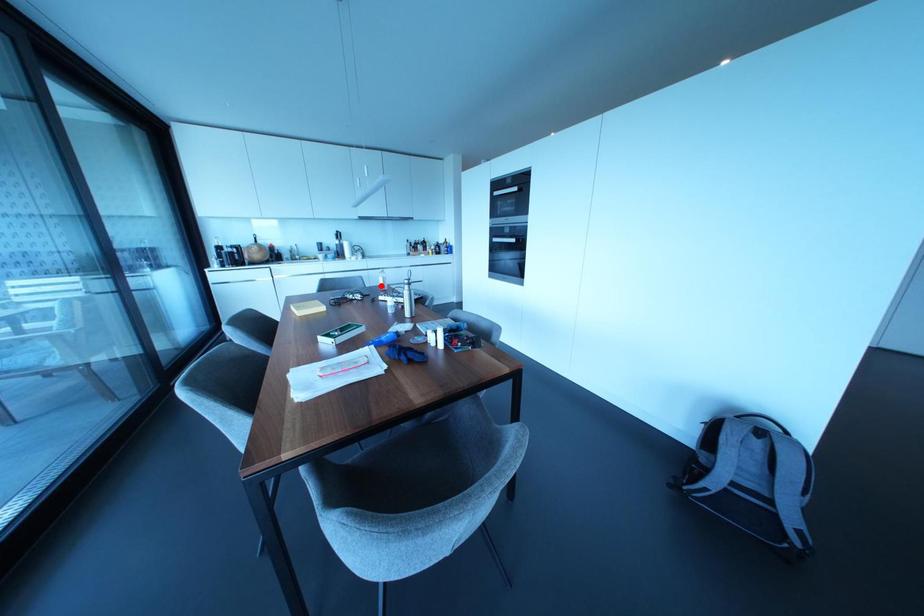
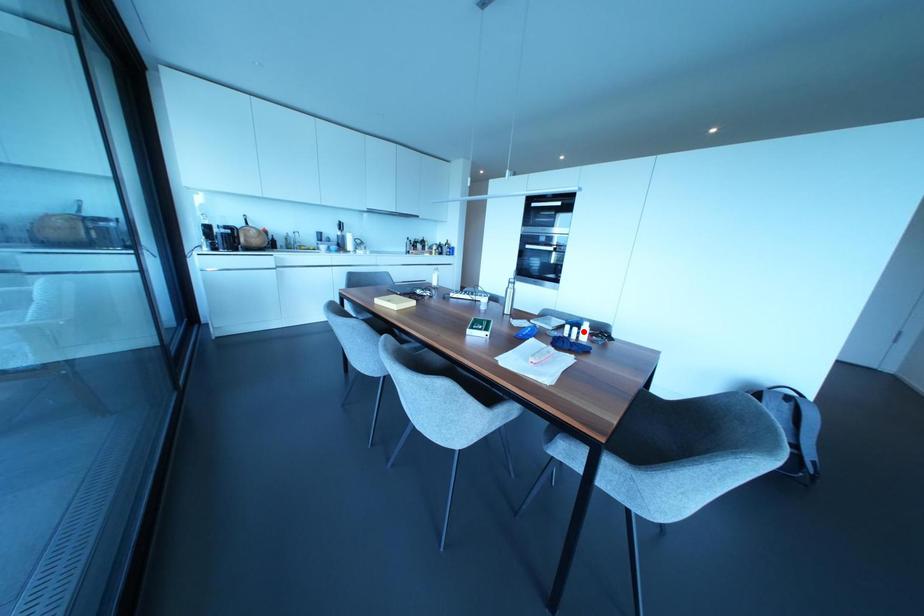
I am providing you with two images of the same scene from different viewpoints. A red point is marked on the first image and another point is marked on the second image. Are the points marked in image1 and image2 representing the same 3D position?

No